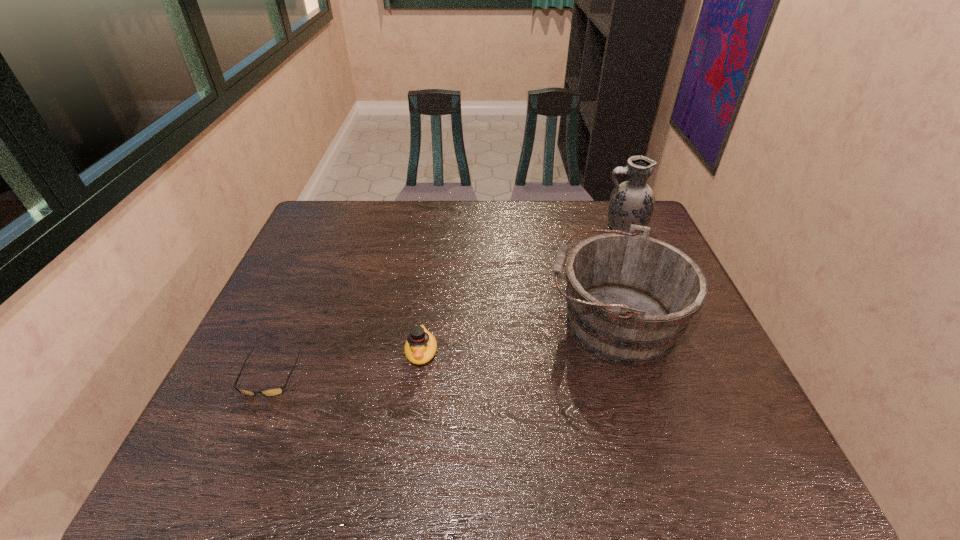
The image size is (960, 540). In order to click on the tallest object in this screenshot , I will do `click(632, 202)`.

Image resolution: width=960 pixels, height=540 pixels. I want to click on vase, so click(x=632, y=202).

Image resolution: width=960 pixels, height=540 pixels. Find the location of `wine bucket`. wine bucket is located at coordinates (629, 297).

What are the coordinates of `the third tallest object` in the screenshot? It's located at (420, 347).

Find the location of a particular element. the second object from left to right is located at coordinates (420, 347).

In order to click on sunglasses in this screenshot , I will do `click(274, 391)`.

You are a GUI agent. You are given a task and a screenshot of the screen. Output one action in this format:
    pyautogui.click(x=<x>, y=<y>)
    Task: Click on the shortest object
    The width and height of the screenshot is (960, 540).
    Given the screenshot: What is the action you would take?
    pyautogui.click(x=274, y=391)

The height and width of the screenshot is (540, 960). What are the coordinates of `vacant region located 0.100m with the handle on the side of the vase` in the screenshot? It's located at (571, 227).

Where is `vacant area situated with the handle on the side of the vase`? The width and height of the screenshot is (960, 540). vacant area situated with the handle on the side of the vase is located at coordinates (548, 227).

The height and width of the screenshot is (540, 960). What are the coordinates of `blank space located with the handle on the side of the vase` in the screenshot? It's located at tap(492, 227).